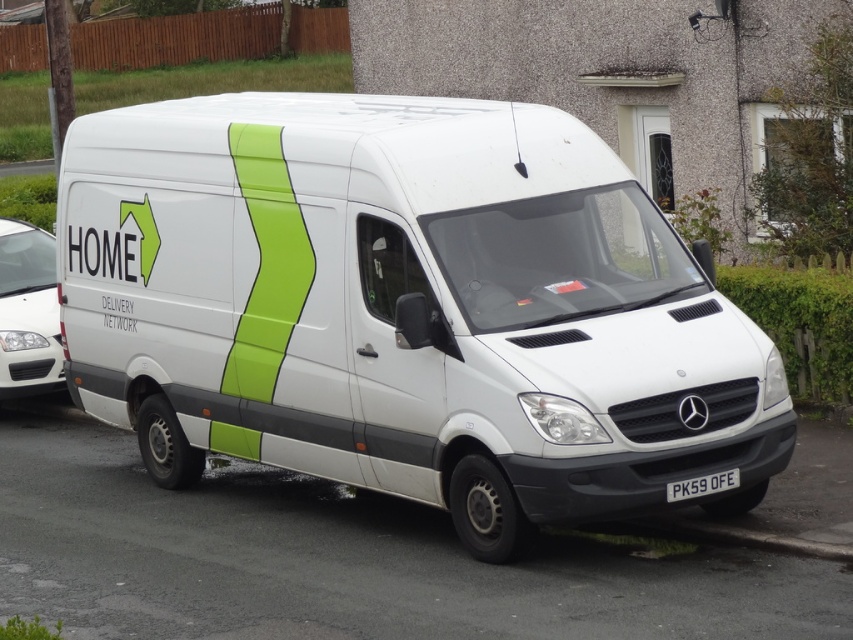
Question: Estimate the real-world distances between objects in this image. Which object is farther from the white plastic license plate at lower center?

Choices:
 (A) white matte van at center
 (B) white glossy car at left

Answer: (B)

Question: Does white matte van at center lie in front of white plastic license plate at lower center?

Choices:
 (A) yes
 (B) no

Answer: (B)

Question: Which object is closer to the camera taking this photo?

Choices:
 (A) white matte van at center
 (B) white glossy car at left

Answer: (A)

Question: Is the position of white matte van at center less distant than that of white glossy car at left?

Choices:
 (A) no
 (B) yes

Answer: (B)

Question: Can you confirm if white matte van at center is positioned to the left of white plastic license plate at lower center?

Choices:
 (A) no
 (B) yes

Answer: (B)

Question: Which object is the farthest from the white glossy car at left?

Choices:
 (A) white plastic license plate at lower center
 (B) white matte van at center

Answer: (A)